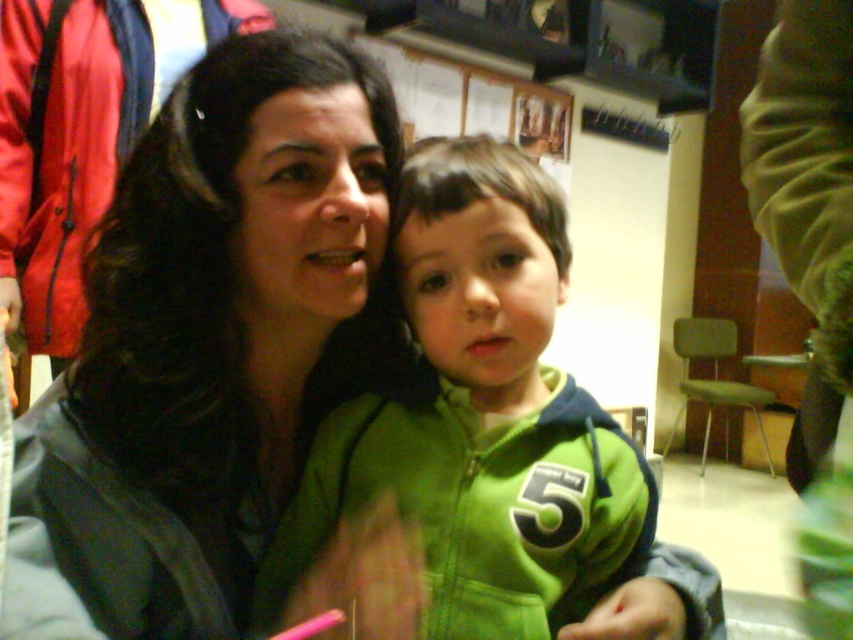
Question: Among these points, which one is farthest from the camera?

Choices:
 (A) (345, 416)
 (B) (73, 269)
 (C) (172, 189)

Answer: (B)

Question: Does green fleece jacket at center come behind matte black jacket at left?

Choices:
 (A) no
 (B) yes

Answer: (A)

Question: Which of the following is the closest to the observer?

Choices:
 (A) (376, 195)
 (B) (459, 276)

Answer: (B)

Question: Which point is closer to the camera?

Choices:
 (A) (578, 572)
 (B) (70, 353)
 (C) (102, 419)

Answer: (C)

Question: Considering the relative positions of green fleece jacket at center and matte black jacket at left in the image provided, where is green fleece jacket at center located with respect to matte black jacket at left?

Choices:
 (A) right
 (B) left

Answer: (A)

Question: Does matte black jacket at upper left have a smaller size compared to green fleece jacket at center?

Choices:
 (A) no
 (B) yes

Answer: (A)